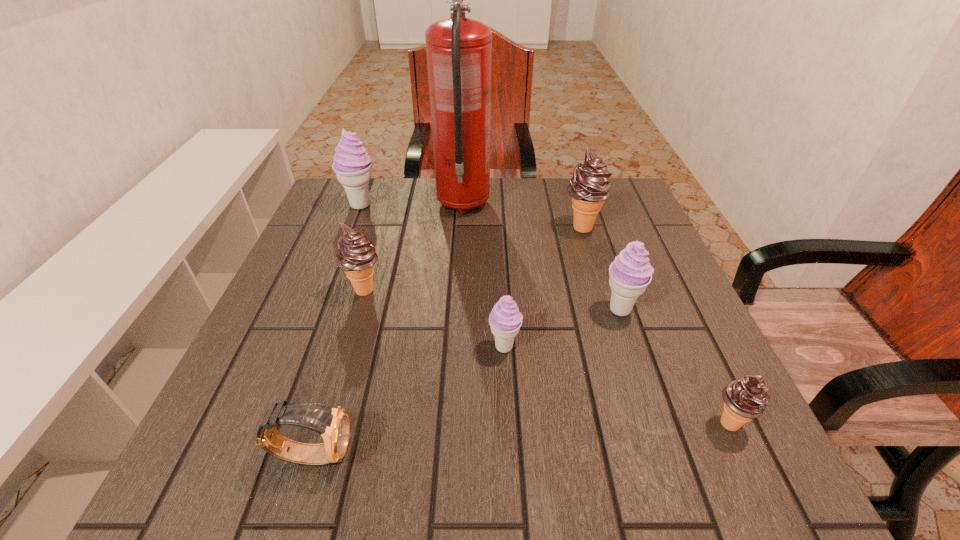
Locate an element on the screen. This screenshot has width=960, height=540. free space between the tallest object and the second farthest chocolate icecream is located at coordinates (414, 247).

This screenshot has width=960, height=540. I want to click on free space between the tallest object and the biggest chocolate icecream, so click(x=523, y=216).

The width and height of the screenshot is (960, 540). I want to click on vacant area that lies between the rightmost object and the second farthest chocolate icecream, so coord(546,356).

Identify which object is the third nearest to the second chocolate icecream from left to right. Please provide its 2D coordinates. Your answer should be formatted as a tuple, i.e. [(x, y)], where the tuple contains the x and y coordinates of a point satisfying the conditions above.

[(505, 320)]

Locate which object ranks third in proximity to the gold watch. Please provide its 2D coordinates. Your answer should be formatted as a tuple, i.e. [(x, y)], where the tuple contains the x and y coordinates of a point satisfying the conditions above.

[(630, 273)]

Find the location of a particular element. the sixth closest icecream to the gold watch is located at coordinates (589, 187).

Locate an element on the screen. This screenshot has width=960, height=540. icecream that is the third closest one to the fifth farthest icecream is located at coordinates (745, 399).

Select which chocolate icecream appears as the closest to the rightmost icecream. Please provide its 2D coordinates. Your answer should be formatted as a tuple, i.e. [(x, y)], where the tuple contains the x and y coordinates of a point satisfying the conditions above.

[(589, 187)]

This screenshot has width=960, height=540. I want to click on chocolate icecream that stands as the third closest to the fire extinguisher, so click(x=745, y=399).

Image resolution: width=960 pixels, height=540 pixels. I want to click on the second closest purple icecream to the gold watch, so click(630, 273).